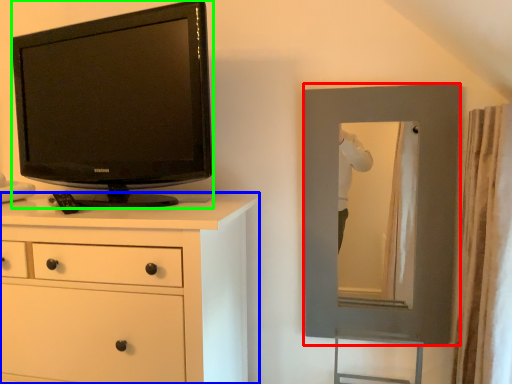
Question: Estimate the real-world distances between objects in this image. Which object is farther from picture frame (highlighted by a red box), chest of drawers (highlighted by a blue box) or television (highlighted by a green box)?

Choices:
 (A) chest of drawers
 (B) television

Answer: (B)